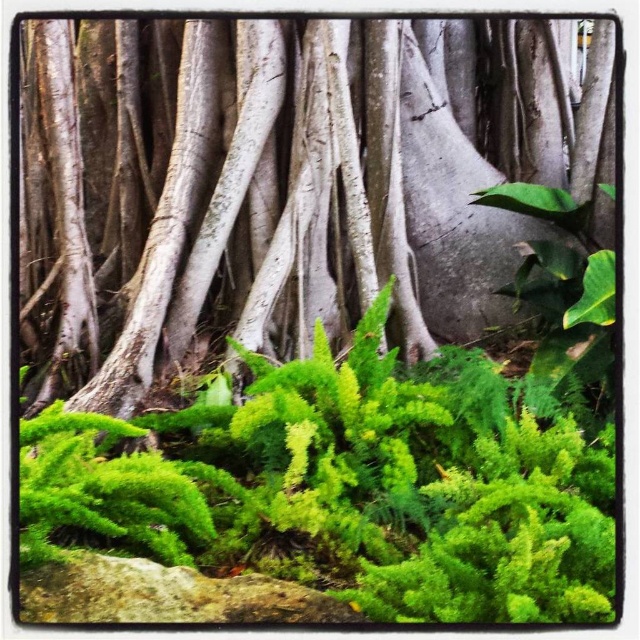
How much distance is there between smooth gray bark at center and gray rough stone at lower center?

The distance of smooth gray bark at center from gray rough stone at lower center is 3.57 feet.

Does smooth gray bark at center appear under gray rough stone at lower center?

No.

Is point (38, 77) closer to camera compared to point (45, 609)?

No, (38, 77) is further to viewer.

Identify the location of smooth gray bark at center. point(288,182).